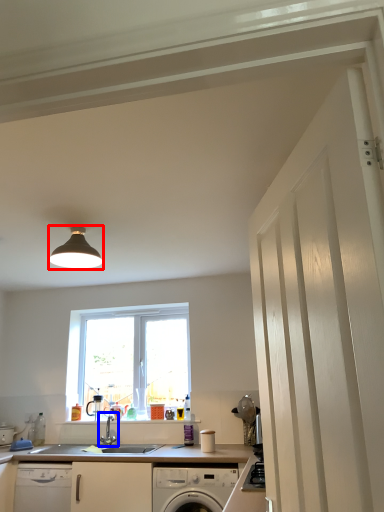
Question: Which of the following is the closest to the observer, light fixture (highlighted by a red box) or tap (highlighted by a blue box)?

Choices:
 (A) light fixture
 (B) tap

Answer: (A)